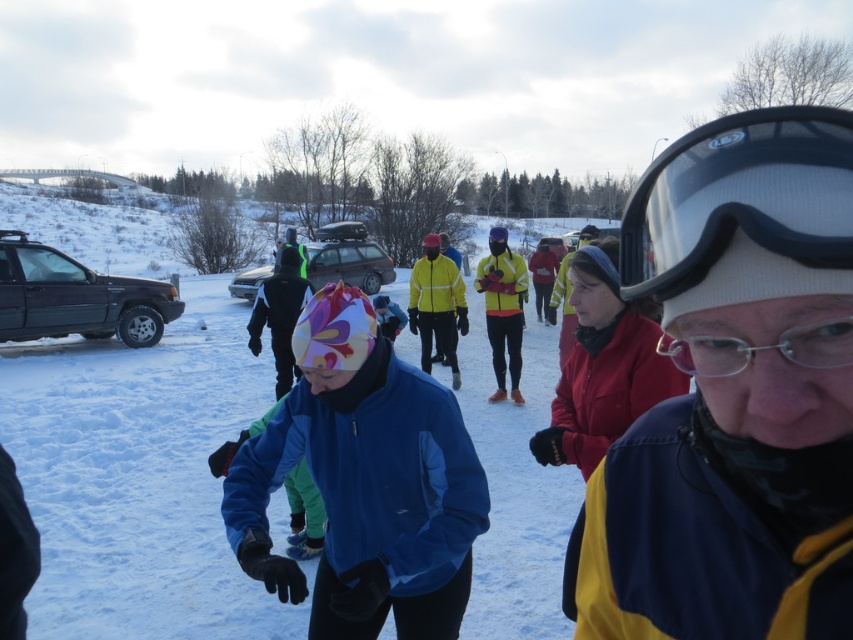
You are standing in the snowy environment shown in the image. There is a point marked at coordinates (138, 476). What is located at that point?

The point at coordinates (138, 476) corresponds to white fluffy snow at center.

You are a photographer trying to capture a clear shot of the transparent plastic goggles at upper right. However, the white fluffy snow at center is blocking your view. Can you adjust your angle to see the goggles without moving them?

The white fluffy snow at center is positioned over transparent plastic goggles at upper right, so you can lower your angle to see the goggles underneath the snow.

You are a photographer trying to capture a closeup shot of the transparent plastic goggles at upper right while also including the yellow and blue jacket at center in the frame. Given the distance between them, will you need to adjust your camera lens to a wider angle or a narrower angle to include both subjects?

The yellow and blue jacket at center is 17.83 centimeters from the transparent plastic goggles at upper right. To include both subjects in the frame, you would need to adjust your camera lens to a wider angle to capture the distance between them.